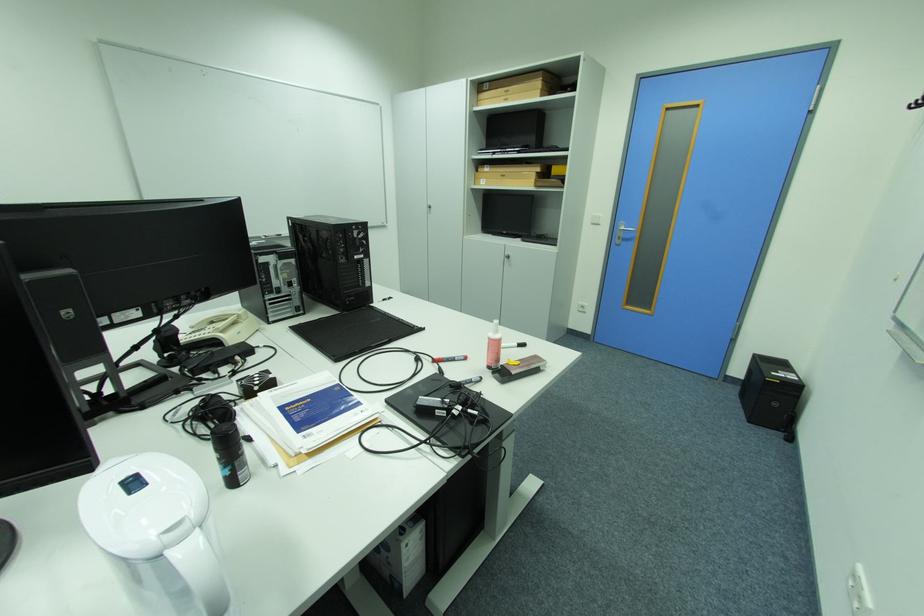
This screenshot has height=616, width=924. I want to click on black spray bottle, so click(229, 454).